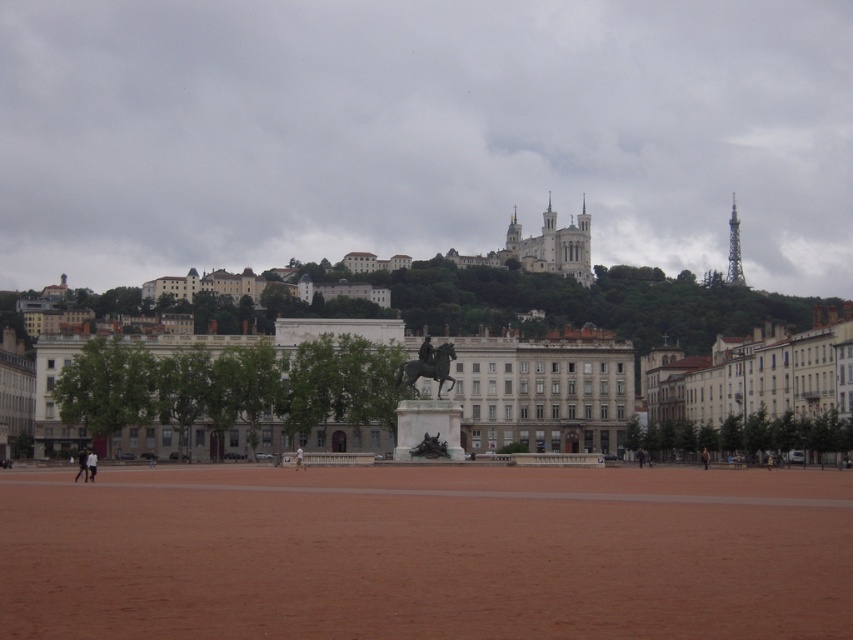
Question: Is brown dirt field at center to the left of white stone castle at upper center from the viewer's perspective?

Choices:
 (A) no
 (B) yes

Answer: (B)

Question: Which point is closer to the camera?

Choices:
 (A) brown dirt field at center
 (B) white stone castle at upper center

Answer: (A)

Question: Is brown dirt field at center positioned at the back of white stone castle at upper center?

Choices:
 (A) no
 (B) yes

Answer: (A)

Question: Among these points, which one is nearest to the camera?

Choices:
 (A) (584, 257)
 (B) (341, 634)

Answer: (B)

Question: Does brown dirt field at center have a larger size compared to white stone castle at upper center?

Choices:
 (A) no
 (B) yes

Answer: (A)